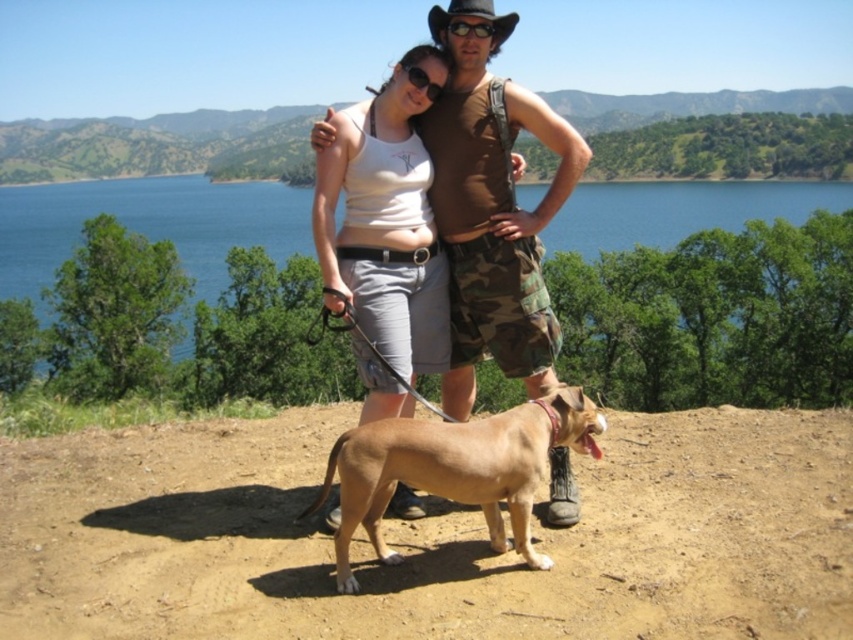
Question: Is brown/camouflage shorts at center to the right of blue water at center from the viewer's perspective?

Choices:
 (A) yes
 (B) no

Answer: (A)

Question: From the image, what is the correct spatial relationship of blue water at center in relation to black matte goggles at center?

Choices:
 (A) left
 (B) right

Answer: (A)

Question: Which point appears farthest from the camera in this image?

Choices:
 (A) (506, 188)
 (B) (463, 426)

Answer: (A)

Question: Which point appears farthest from the camera in this image?

Choices:
 (A) (486, 24)
 (B) (432, 307)

Answer: (B)

Question: Based on their relative distances, which object is farther from the brown leather dog at center?

Choices:
 (A) brown/camouflage shorts at center
 (B) blue water at center
 (C) white cotton tank top at center
 (D) black matte goggles at center

Answer: (B)

Question: From the image, what is the correct spatial relationship of blue water at center in relation to brown leather dog at center?

Choices:
 (A) above
 (B) below

Answer: (A)